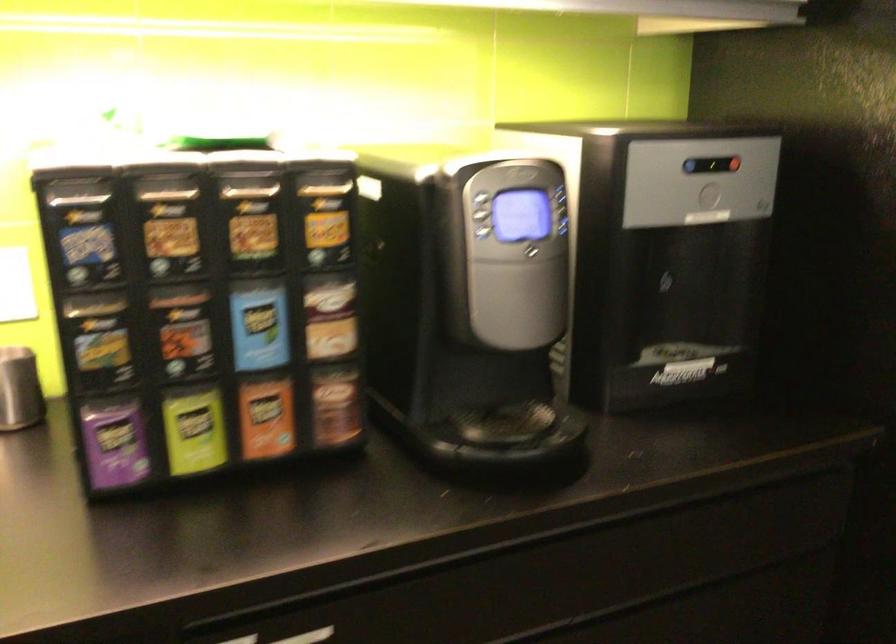
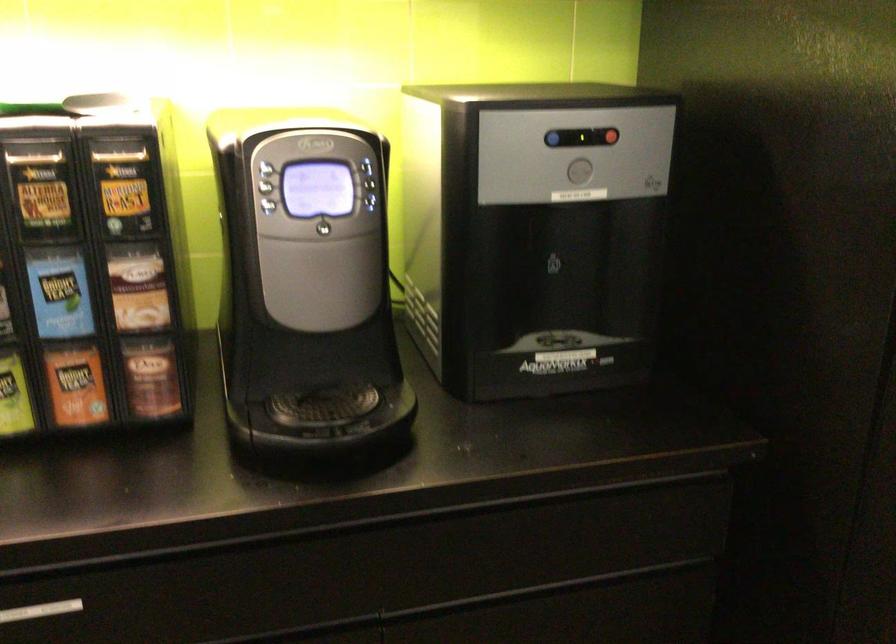
The point at (480,196) is marked in the first image. Where is the corresponding point in the second image?

(263, 169)